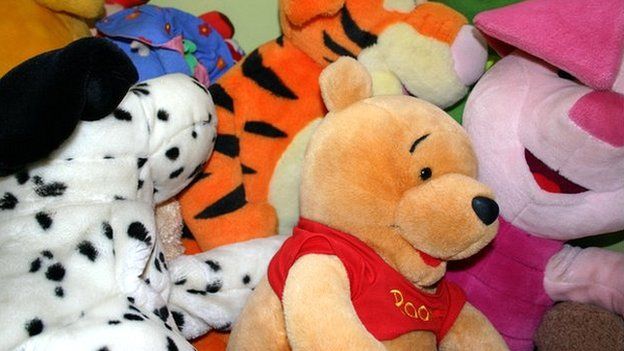
This screenshot has width=624, height=351. In order to click on plush dolls in this screenshot , I will do coord(120,161), coord(268,131), coord(205,69), coord(396,179), coord(520,122).